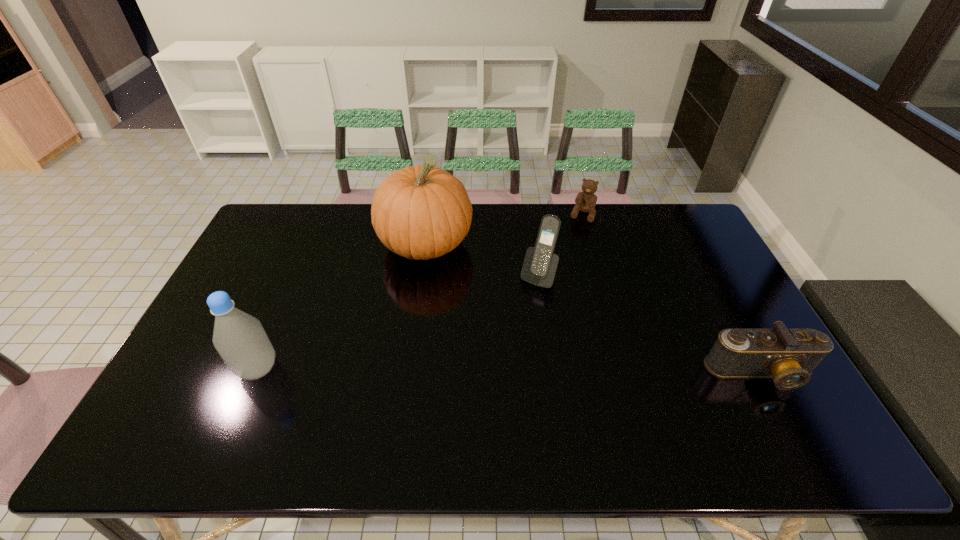
This screenshot has height=540, width=960. I want to click on the second tallest object, so click(240, 339).

Locate an element on the screen. The width and height of the screenshot is (960, 540). bottle is located at coordinates click(x=240, y=339).

Find the location of a particular element. This screenshot has width=960, height=540. the rightmost object is located at coordinates (788, 356).

Find the location of `the tallest object`. the tallest object is located at coordinates (421, 212).

Find the location of a particular element. Image resolution: width=960 pixels, height=540 pixels. pumpkin is located at coordinates (421, 212).

Locate an element on the screen. The width and height of the screenshot is (960, 540). cellular telephone is located at coordinates (540, 264).

Where is `the third tallest object`? The image size is (960, 540). the third tallest object is located at coordinates (540, 264).

Find the location of a particular element. This screenshot has height=540, width=960. teddy bear is located at coordinates (585, 201).

Identify the location of vacant area located 0.310m on the back of the leftmost object. (299, 273).

Where is `free space located 0.140m on the stem of the pumpkin`? free space located 0.140m on the stem of the pumpkin is located at coordinates (468, 300).